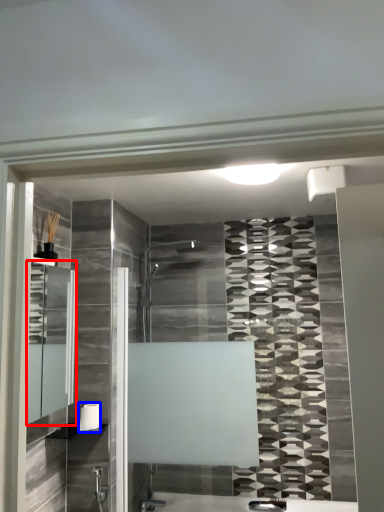
Question: Which object is further to the camera taking this photo, medicine cabinet (highlighted by a red box) or towel bar (highlighted by a blue box)?

Choices:
 (A) medicine cabinet
 (B) towel bar

Answer: (B)